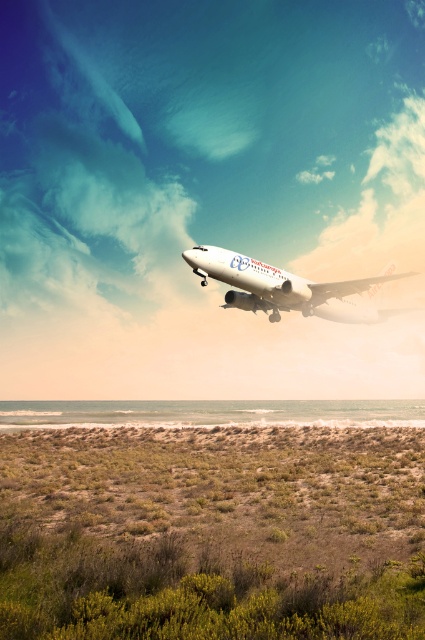
Question: Which point is farther to the camera?

Choices:
 (A) (289, 275)
 (B) (130, 579)

Answer: (A)

Question: Is green shrubbery at lower center to the left of white glossy airplane at upper center from the viewer's perspective?

Choices:
 (A) no
 (B) yes

Answer: (B)

Question: Which of the following is the farthest from the observer?

Choices:
 (A) green shrubbery at lower center
 (B) white glossy airplane at upper center

Answer: (B)

Question: Among these objects, which one is nearest to the camera?

Choices:
 (A) white glossy airplane at upper center
 (B) green shrubbery at lower center

Answer: (B)

Question: In this image, where is green shrubbery at lower center located relative to white glossy airplane at upper center?

Choices:
 (A) left
 (B) right

Answer: (A)

Question: Does green shrubbery at lower center appear on the right side of white glossy airplane at upper center?

Choices:
 (A) yes
 (B) no

Answer: (B)